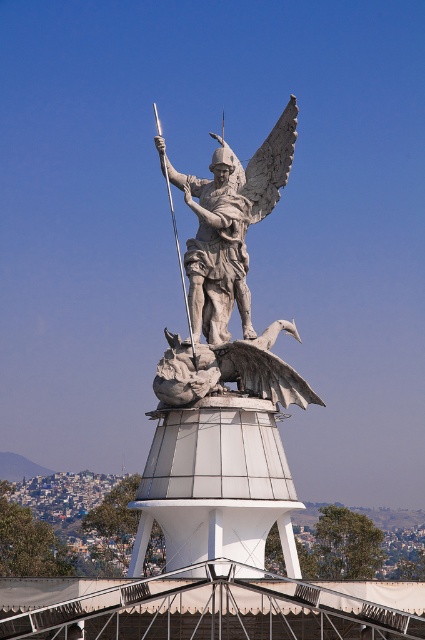
You are a maintenance worker needing to reach both the polished stone angel at center and the polished silver spear at center for cleaning. The ladder you have is 25 feet long. Can you safely reach both objects with the ladder without moving it?

The distance between the polished stone angel at center and the polished silver spear at center is 27.49 feet. Since the ladder is only 25 feet long, it is not long enough to safely reach both objects without moving it.

You are an art student analyzing the statue and angel in the image. Which object is larger in height between the white stone statue at center and the polished stone angel at center?

The white stone statue at center is much taller than the polished stone angel at center.

You are a tour guide standing at the base of the monument. You want to explain to visitors the distance between the two statues. How far apart are the white stone statue at center and the polished stone angel at center?

The white stone statue at center is 5.63 meters away from the polished stone angel at center.